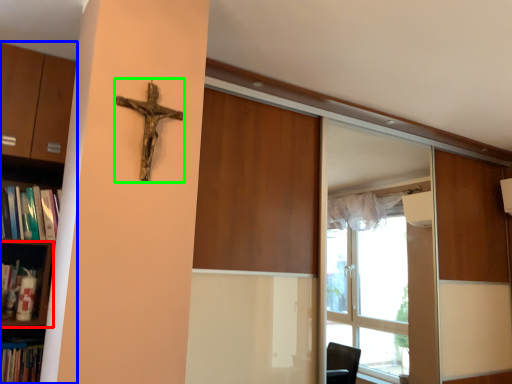
Question: Based on their relative distances, which object is nearer to shelf (highlighted by a red box)? Choose from shelf (highlighted by a blue box) and crucifix (highlighted by a green box).

Choices:
 (A) shelf
 (B) crucifix

Answer: (A)